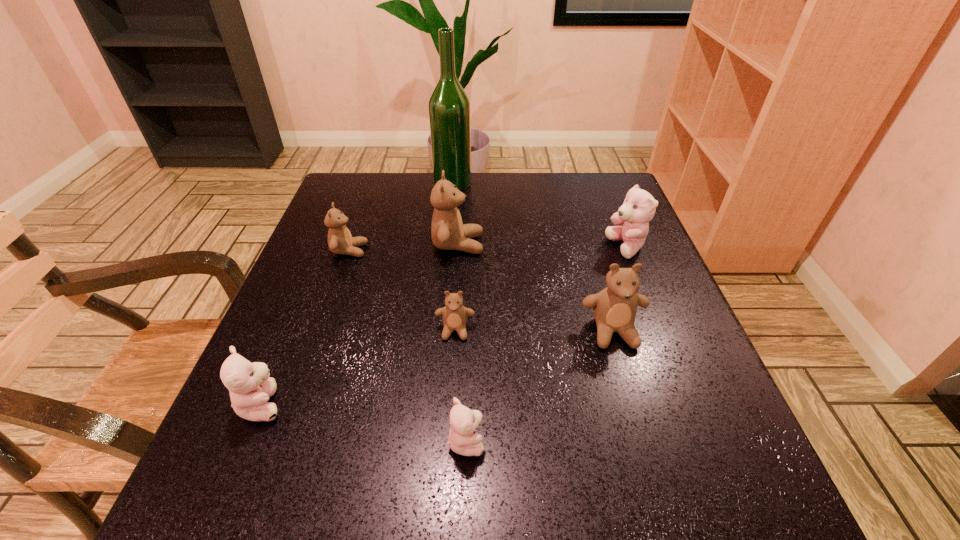
Locate an element on the screen. The width and height of the screenshot is (960, 540). free space between the leftmost pink teddy bear and the smallest brown teddy bear is located at coordinates (359, 367).

You are a GUI agent. You are given a task and a screenshot of the screen. Output one action in this format:
    pyautogui.click(x=<x>, y=<y>)
    Task: Click on the blank region between the second smallest brown teddy bear and the second biggest brown teddy bear
    
    Given the screenshot: What is the action you would take?
    pyautogui.click(x=481, y=291)

Locate an element on the screen. The image size is (960, 540). free space that is in between the smallest brown teddy bear and the leftmost pink teddy bear is located at coordinates (359, 367).

Where is `unoccupied area between the biggest brown teddy bear and the rightmost pink teddy bear`? unoccupied area between the biggest brown teddy bear and the rightmost pink teddy bear is located at coordinates (542, 246).

The width and height of the screenshot is (960, 540). Find the location of `vacant space in between the smallest brown teddy bear and the tallest teddy bear`. vacant space in between the smallest brown teddy bear and the tallest teddy bear is located at coordinates (457, 287).

This screenshot has height=540, width=960. I want to click on free point between the tallest object and the rightmost pink teddy bear, so click(540, 215).

Where is `vacant area that lies between the second biggest pink teddy bear and the tallest object`? vacant area that lies between the second biggest pink teddy bear and the tallest object is located at coordinates (358, 293).

The image size is (960, 540). In order to click on empty space that is in between the leftmost pink teddy bear and the leftmost brown teddy bear in this screenshot , I will do `click(306, 327)`.

The width and height of the screenshot is (960, 540). What are the coordinates of `object identified as the fourth closest to the second biggest brown teddy bear` in the screenshot? It's located at (448, 232).

Select which object is the fifth closest to the second biggest pink teddy bear. Please provide its 2D coordinates. Your answer should be formatted as a tuple, i.e. [(x, y)], where the tuple contains the x and y coordinates of a point satisfying the conditions above.

[(614, 308)]